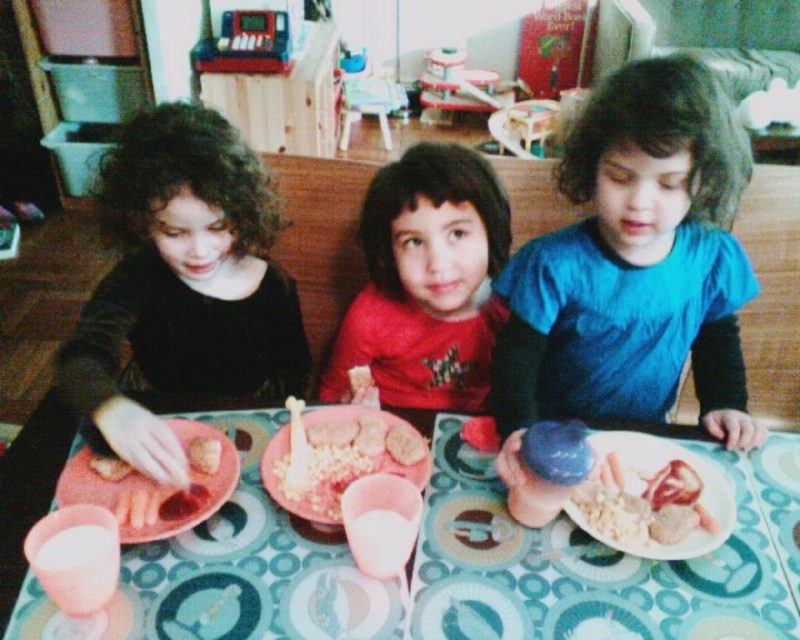
Describe the element at coordinates (182, 285) in the screenshot. I see `matte black shirt at left` at that location.

Between point (88, 339) and point (498, 445), which one is positioned behind?

The point (88, 339) is more distant.

Where is `matte black shirt at left`? This screenshot has height=640, width=800. matte black shirt at left is located at coordinates (182, 285).

Who is positioned more to the left, patterned plastic table at center or smooth white bread at center?

Positioned to the left is patterned plastic table at center.

From the picture: Does patterned plastic table at center appear on the right side of smooth white bread at center?

Incorrect, patterned plastic table at center is not on the right side of smooth white bread at center.

Between point (574, 548) and point (688, 468), which one is positioned in front?

Point (574, 548) is in front.

Identify the location of patterned plastic table at center. (468, 564).

Does red matte shirt at center have a greater height compared to pink matte plastic fork at lower left?

Yes.

Between red matte shirt at center and pink matte plastic fork at lower left, which one is positioned lower?

pink matte plastic fork at lower left

Describe the element at coordinates (425, 282) in the screenshot. The width and height of the screenshot is (800, 640). I see `red matte shirt at center` at that location.

The height and width of the screenshot is (640, 800). In order to click on red matte shirt at center in this screenshot , I will do `click(425, 282)`.